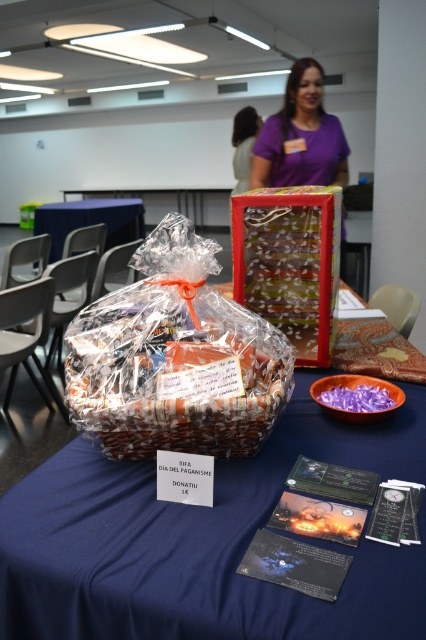
You are organizing a charity event and need to determine which item takes up more horizontal space on the table. You see a clear plastic bag at center and a plastic wrapped basket at center. Which one is wider?

The clear plastic bag at center might be wider than plastic wrapped basket at center, so the clear plastic bag at center is likely wider.

You are at an event and want to place a small card on top of the plastic wrapped basket at center so attendees can see it. Considering the height of the purple translucent bowl at lower center, will the card be visible over the bowl?

The plastic wrapped basket at center is much taller than the purple translucent bowl at lower center, so placing the card on top of the plastic wrapped basket at center will make it visible over the purple translucent bowl at lower center.

You are standing at the table and want to reach the plastic wrapped basket at center to place your ticket inside. Is the clear plastic bag at center blocking your direct path to the basket?

The clear plastic bag at center is further to the viewer than plastic wrapped basket at center, so the basket is behind the bag. Therefore, the clear plastic bag at center is blocking your direct path to the plastic wrapped basket at center.